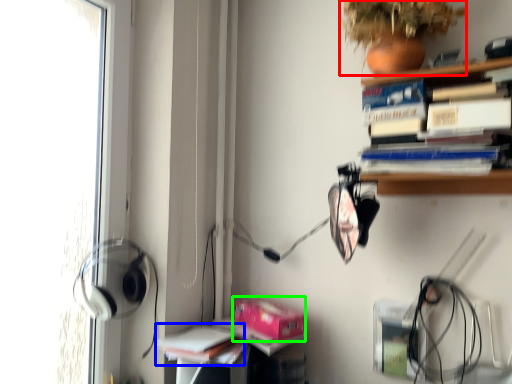
Question: Considering the real-world distances, which object is farthest from plant (highlighted by a red box)? book (highlighted by a blue box) or paperback book (highlighted by a green box)?

Choices:
 (A) book
 (B) paperback book

Answer: (A)